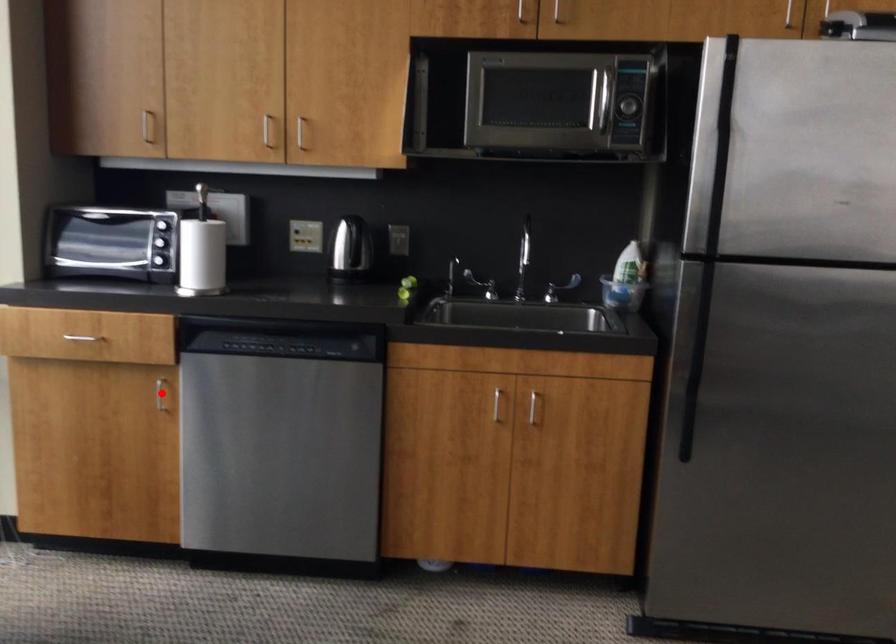
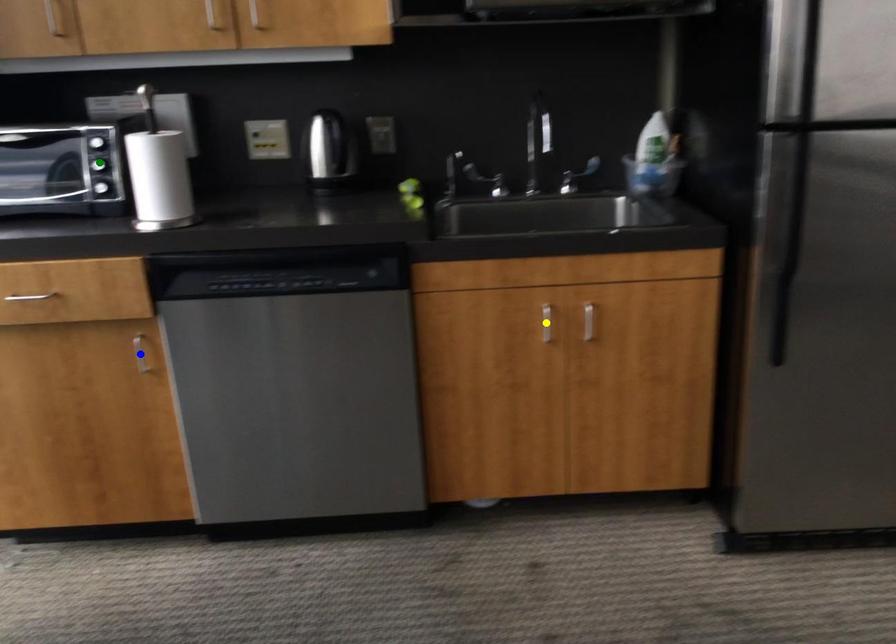
Question: I am providing you with two images of the same scene from different viewpoints. A red point is marked on the first image. You are given multiple points on the second image. Can you choose the point in image 2 that corresponds to the point in image 1?

Choices:
 (A) blue point
 (B) green point
 (C) yellow point

Answer: (A)